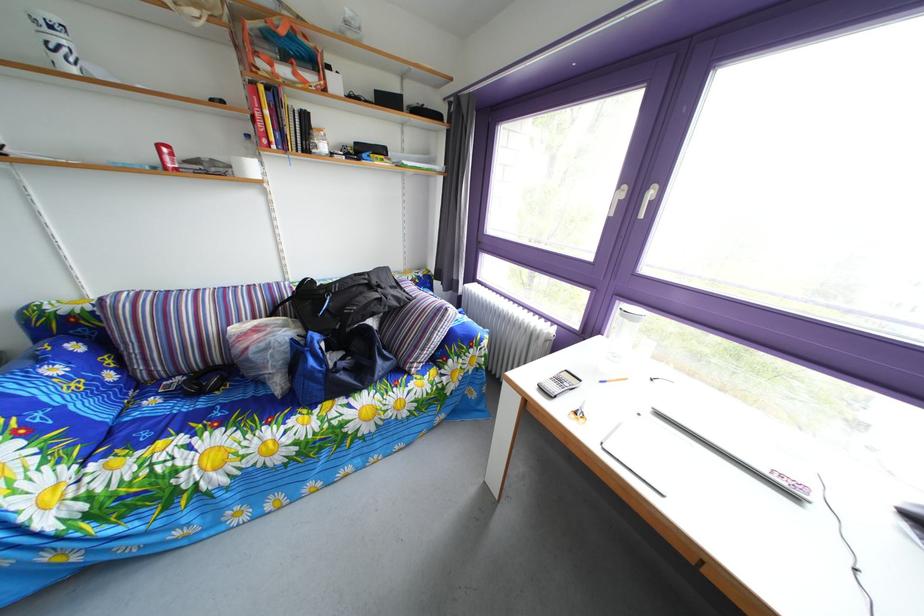
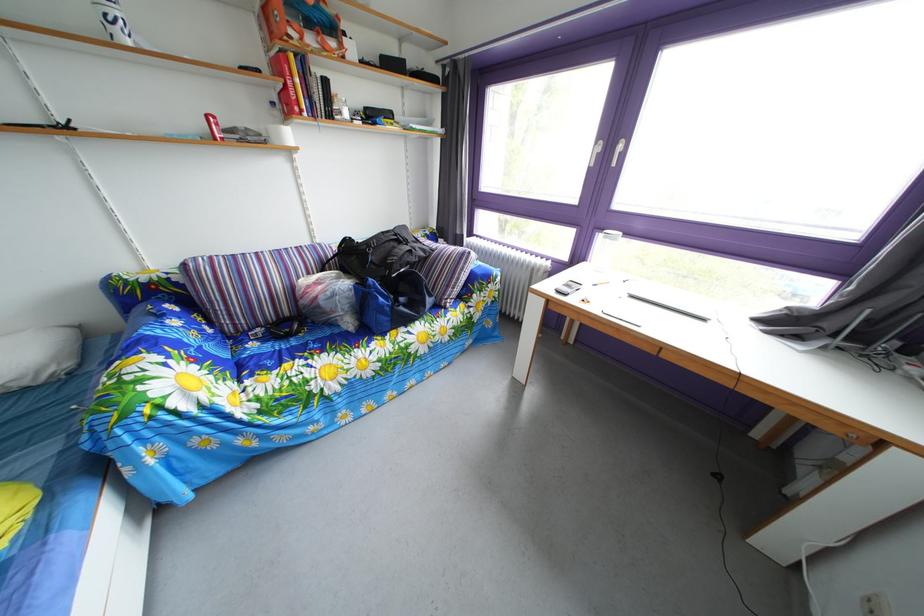
In the second image, find the point that corresponds to (x=296, y=65) in the first image.

(320, 33)